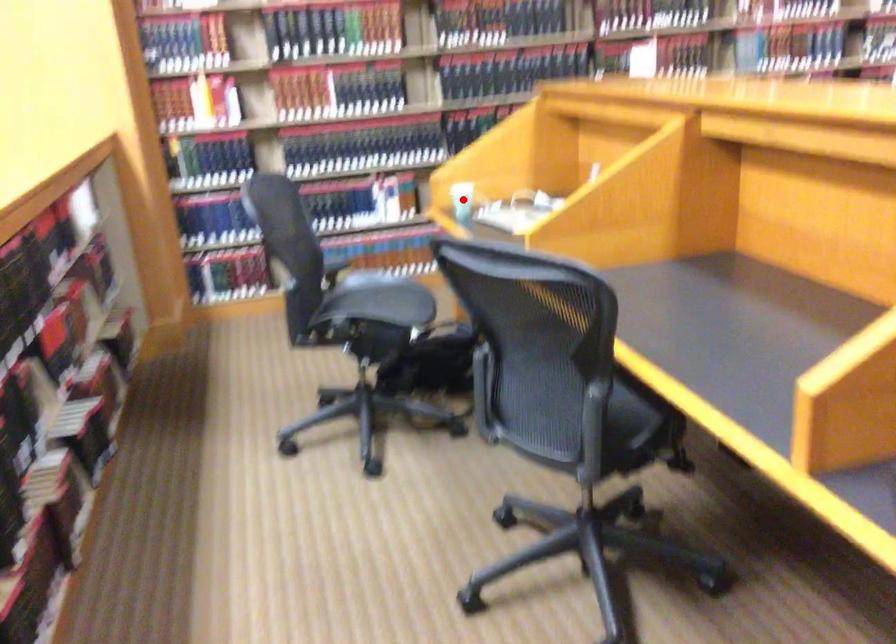
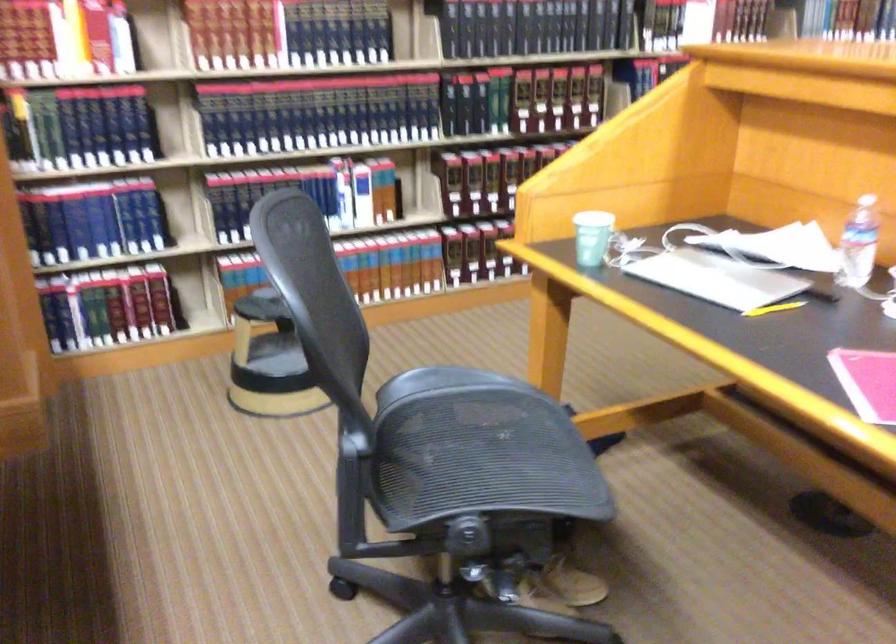
Question: I am providing you with two images of the same scene from different viewpoints. A red point is shown in image1. For the corresponding object point in image2, is it positioned nearer or farther from the camera?

Choices:
 (A) Nearer
 (B) Farther

Answer: (A)